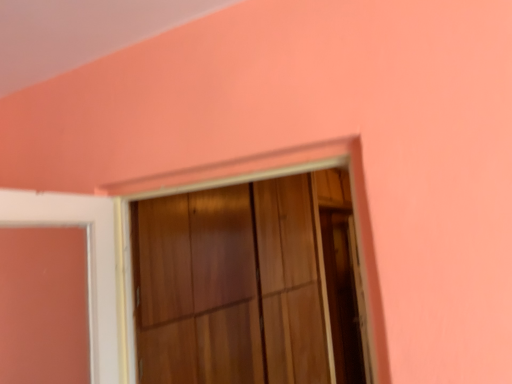
Question: Are transparent glass screen door at right and wooden frame at center located far from each other?

Choices:
 (A) no
 (B) yes

Answer: (B)

Question: Is transparent glass screen door at right positioned in front of wooden frame at center?

Choices:
 (A) no
 (B) yes

Answer: (A)

Question: Considering the relative sizes of transparent glass screen door at right and wooden frame at center in the image provided, is transparent glass screen door at right smaller than wooden frame at center?

Choices:
 (A) yes
 (B) no

Answer: (A)

Question: From the image's perspective, is transparent glass screen door at right on top of wooden frame at center?

Choices:
 (A) no
 (B) yes

Answer: (A)

Question: Does transparent glass screen door at right have a larger size compared to wooden frame at center?

Choices:
 (A) yes
 (B) no

Answer: (B)

Question: Is transparent glass screen door at right aimed at wooden frame at center?

Choices:
 (A) no
 (B) yes

Answer: (A)

Question: Is wooden frame at center directly adjacent to transparent glass screen door at right?

Choices:
 (A) yes
 (B) no

Answer: (B)

Question: Can you confirm if wooden frame at center is shorter than transparent glass screen door at right?

Choices:
 (A) no
 (B) yes

Answer: (B)

Question: Can you confirm if wooden frame at center is wider than transparent glass screen door at right?

Choices:
 (A) yes
 (B) no

Answer: (A)

Question: Can you confirm if wooden frame at center is taller than transparent glass screen door at right?

Choices:
 (A) yes
 (B) no

Answer: (B)

Question: Is wooden frame at center at the left side of transparent glass screen door at right?

Choices:
 (A) yes
 (B) no

Answer: (A)

Question: Does wooden frame at center appear on the right side of transparent glass screen door at right?

Choices:
 (A) yes
 (B) no

Answer: (B)

Question: Based on their positions, is wooden frame at center located to the left or right of transparent glass screen door at right?

Choices:
 (A) left
 (B) right

Answer: (A)